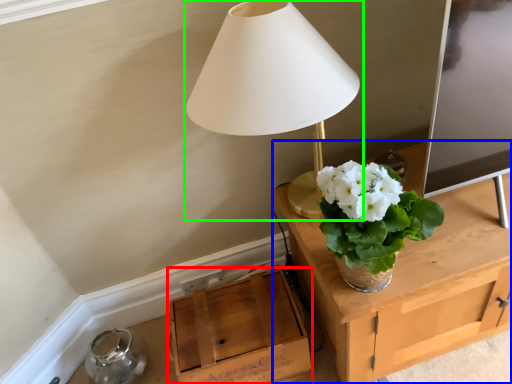
Question: Which object is positioned closest to cardboard box (highlighted by a red box)? Select from table (highlighted by a blue box) and lamp (highlighted by a green box).

Choices:
 (A) table
 (B) lamp

Answer: (A)